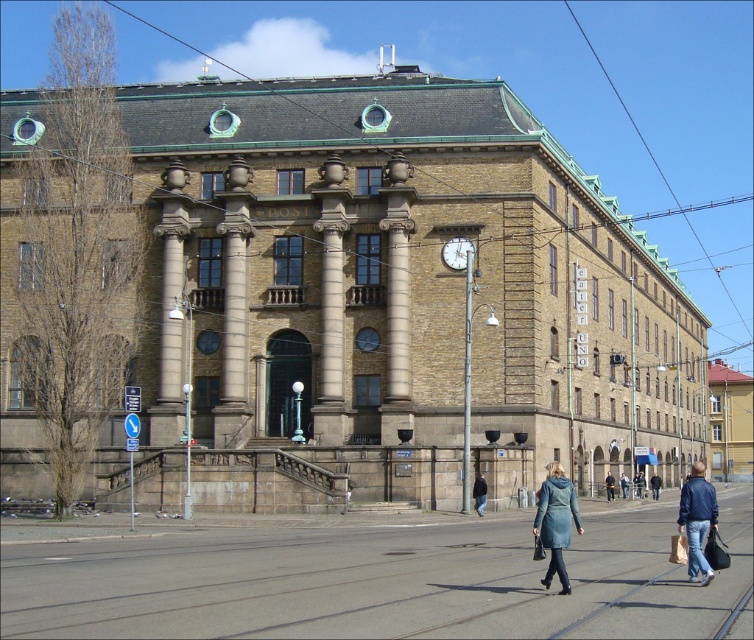
Locate an element on the screen. Image resolution: width=754 pixels, height=640 pixels. blue denim jacket at lower right is located at coordinates (697, 520).

The width and height of the screenshot is (754, 640). What do you see at coordinates (697, 520) in the screenshot?
I see `blue denim jacket at lower right` at bounding box center [697, 520].

You are a GUI agent. You are given a task and a screenshot of the screen. Output one action in this format:
    pyautogui.click(x=<x>, y=<y>)
    Task: Click on the blue denim jacket at lower right
    The image size is (754, 640).
    Given the screenshot: What is the action you would take?
    pyautogui.click(x=697, y=520)

Is point (448, 246) positioned after point (636, 497)?

That is False.

The width and height of the screenshot is (754, 640). What do you see at coordinates (455, 252) in the screenshot?
I see `brass metallic clock at center` at bounding box center [455, 252].

The width and height of the screenshot is (754, 640). In order to click on brass metallic clock at center in this screenshot , I will do `click(455, 252)`.

Which is in front, point (541, 528) or point (480, 515)?

Point (541, 528) is more forward.

Is teal fabric coat at lower center to the left of black leather jacket at lower center from the viewer's perspective?

In fact, teal fabric coat at lower center is to the right of black leather jacket at lower center.

Is point (556, 522) closer to camera compared to point (474, 497)?

Yes, it is in front of point (474, 497).

This screenshot has height=640, width=754. I want to click on teal fabric coat at lower center, so click(556, 522).